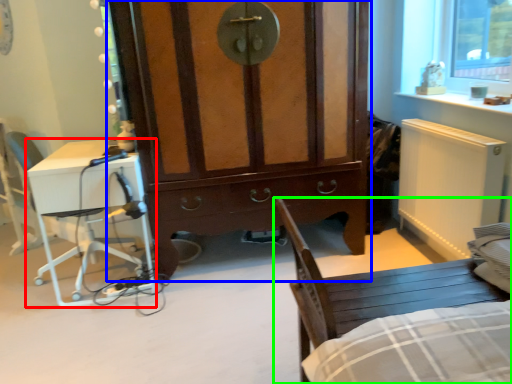
Question: Which object is positioned farthest from desk (highlighted by a red box)? Select from cabinetry (highlighted by a blue box) and chair (highlighted by a green box).

Choices:
 (A) cabinetry
 (B) chair

Answer: (B)